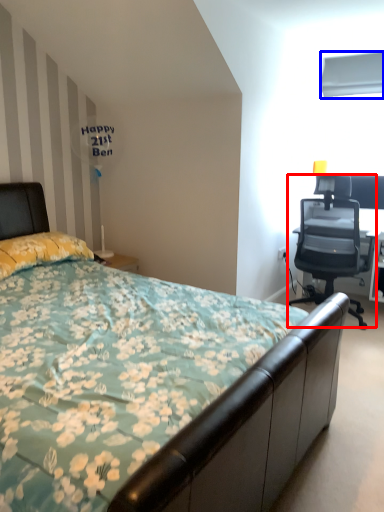
Question: Among these objects, which one is nearest to the camera, chair (highlighted by a red box) or window screen (highlighted by a blue box)?

Choices:
 (A) chair
 (B) window screen

Answer: (A)